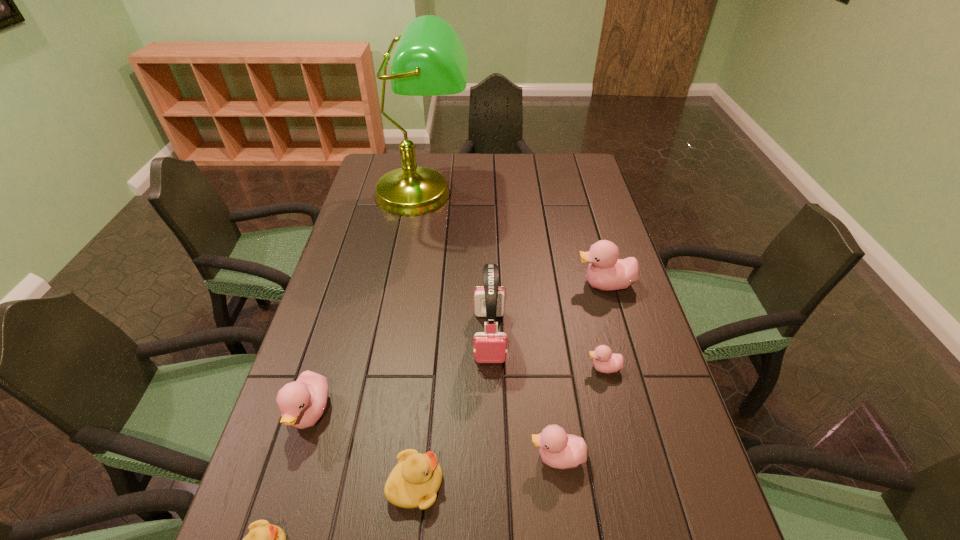
The width and height of the screenshot is (960, 540). I want to click on free space located on the front-facing side of the third object from right to left, so click(422, 457).

I want to click on vacant space situated on the front-facing side of the third object from right to left, so click(x=385, y=457).

Find the location of a particular element. free spot located 0.230m on the front-facing side of the farther yellow duckling is located at coordinates (555, 484).

The width and height of the screenshot is (960, 540). Identify the location of vacant area situated on the front-facing side of the fifth nearest duckling. (566, 368).

Locate an element on the screen. vacant region located 0.070m on the front-facing side of the fifth nearest duckling is located at coordinates (558, 368).

The height and width of the screenshot is (540, 960). What are the coordinates of `vacant space located 0.120m on the front-facing side of the fifth nearest duckling` in the screenshot? It's located at (539, 368).

The width and height of the screenshot is (960, 540). What are the coordinates of `object situated at the far edge` in the screenshot? It's located at (430, 60).

The image size is (960, 540). Find the location of `lamp that is at the left edge`. lamp that is at the left edge is located at coordinates (430, 60).

Where is `duckling at the left edge`? duckling at the left edge is located at coordinates (302, 402).

Locate an element on the screen. object situated at the far left corner is located at coordinates (430, 60).